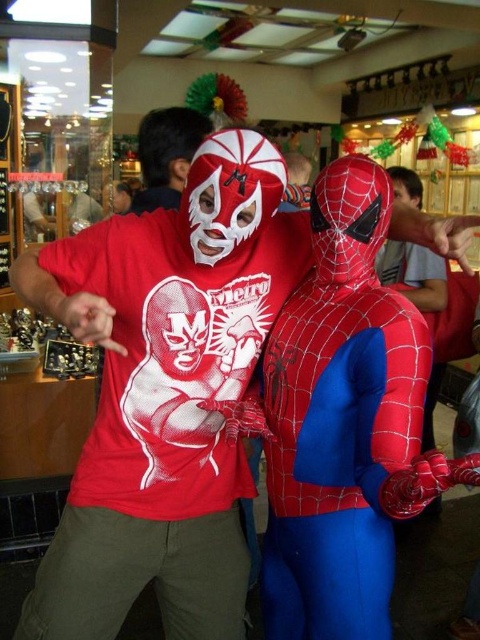
You are at an event and want to take a photo of both the wrestler in the red tshirt with white wrestling mask and the Spiderman in red and blue suit. You notice two points in the image labeled as point 1 at coordinates (277, 566) and point 2 at (240, 180). Which point is closer to you, point 1 or point 2?

Point 1 at coordinates (277, 566) is closer to you than point 2 at (240, 180) because the description states that point 1 is further to the viewer than point 2. Wait, there might be confusion here. Let me check the description again. The user provided that point (277, 566) is further to the viewer than point (240, 180). So actually, point 1 is further away from the viewer, meaning point 2 is closer. Hmm, the initial answer had an error. Let me correct that. The correct answer should be point 2 is at

You are at a costume party and see two people wearing masks. One has a white matte mask at center and the other has a matte white mask at center. Which mask is on the right side?

The white matte mask at center is positioned on the right side of the matte white mask at center.

You are a costume designer trying to fit a new costume for a character. You have a red spandex suit at center and a white matte mask at center. Which item would require a larger storage space when packing?

The red spandex suit at center is larger in size than the white matte mask at center, so it would require more storage space when packing.